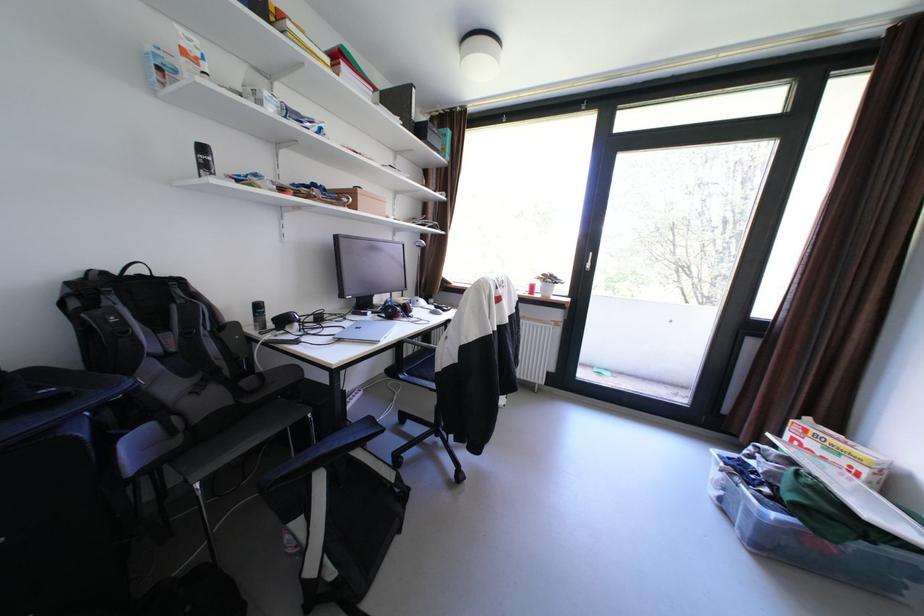
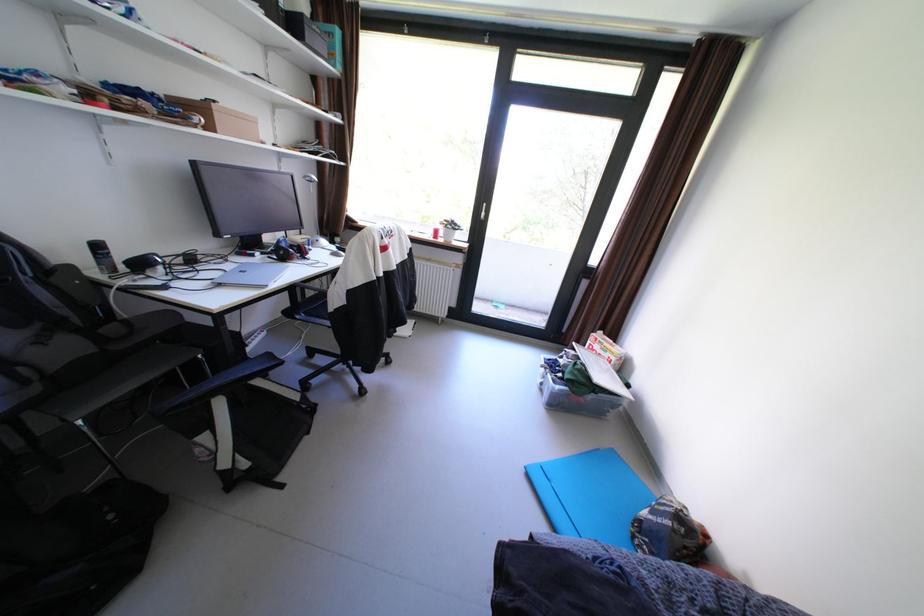
The point at (383, 313) is marked in the first image. Where is the corresponding point in the second image?

(274, 254)